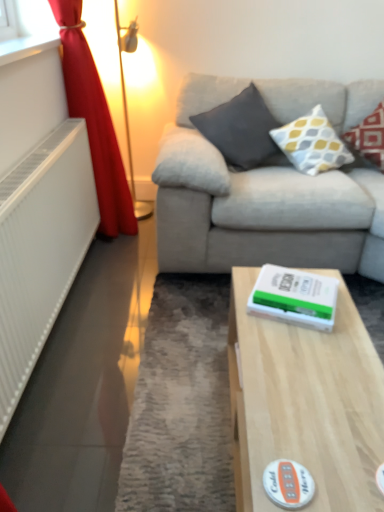
Locate an element on the screen. Image resolution: width=384 pixels, height=512 pixels. vacant space situated above light wood table at center (from a real-world perspective) is located at coordinates (311, 380).